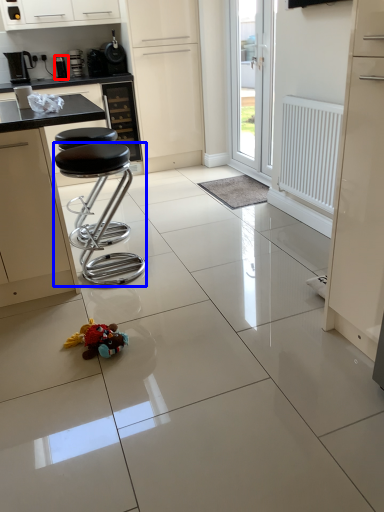
Question: Which of the following is the closest to the observer, appliance (highlighted by a red box) or stool (highlighted by a blue box)?

Choices:
 (A) appliance
 (B) stool

Answer: (B)